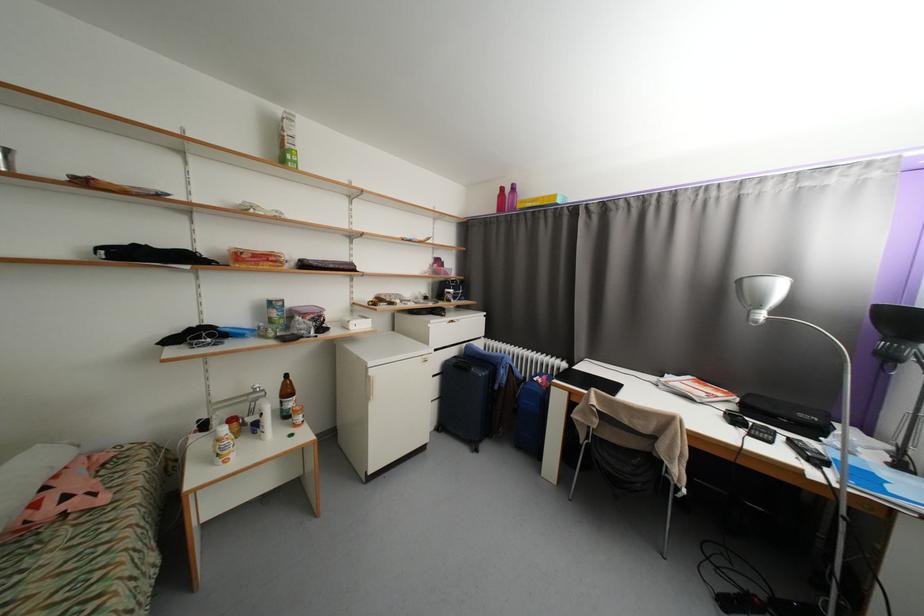
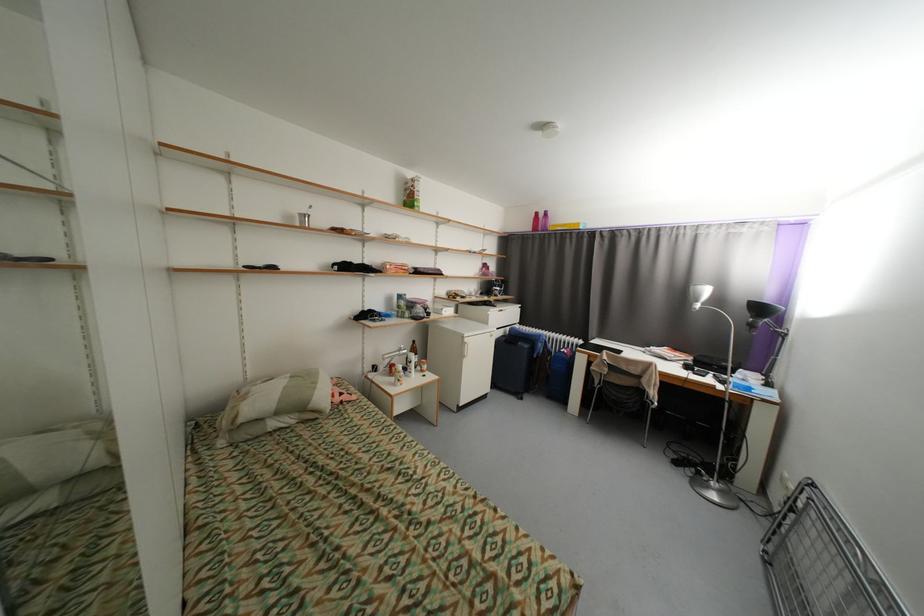
In the second image, find the point that corresponds to [508,190] in the first image.

(542, 215)